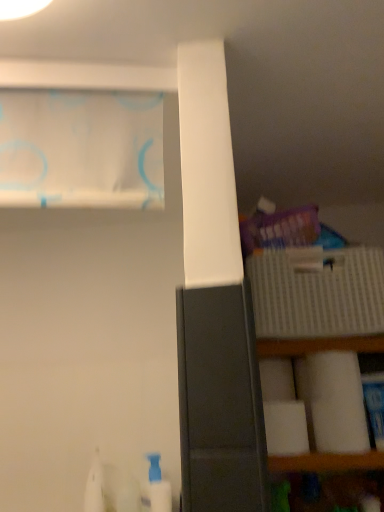
Question: Is white matte toilet paper at lower right, the first toilet paper from the back, surrounding white sheer curtain at upper left?

Choices:
 (A) no
 (B) yes

Answer: (A)

Question: Can you see white matte toilet paper at lower right, which ranks as the 2th toilet paper in front-to-back order, touching white sheer curtain at upper left?

Choices:
 (A) no
 (B) yes

Answer: (A)

Question: Is white matte toilet paper at lower right, the first toilet paper from the back, looking in the opposite direction of white sheer curtain at upper left?

Choices:
 (A) no
 (B) yes

Answer: (A)

Question: From the image's perspective, is white matte toilet paper at lower right, the first toilet paper from the back, located above white sheer curtain at upper left?

Choices:
 (A) yes
 (B) no

Answer: (B)

Question: Is the depth of white matte toilet paper at lower right, which ranks as the 2th toilet paper in front-to-back order, greater than that of white sheer curtain at upper left?

Choices:
 (A) no
 (B) yes

Answer: (B)

Question: From the image's perspective, does white matte toilet paper at lower right, which ranks as the 2th toilet paper in front-to-back order, appear lower than white sheer curtain at upper left?

Choices:
 (A) yes
 (B) no

Answer: (A)

Question: Is white sheer curtain at upper left at the back of white plastic bottle at lower left?

Choices:
 (A) no
 (B) yes

Answer: (A)

Question: Would you say white plastic bottle at lower left is a long distance from white sheer curtain at upper left?

Choices:
 (A) yes
 (B) no

Answer: (B)

Question: Does white plastic bottle at lower left appear on the left side of white sheer curtain at upper left?

Choices:
 (A) no
 (B) yes

Answer: (A)

Question: Is white plastic bottle at lower left wider than white sheer curtain at upper left?

Choices:
 (A) no
 (B) yes

Answer: (B)

Question: Is white plastic bottle at lower left next to white sheer curtain at upper left and touching it?

Choices:
 (A) yes
 (B) no

Answer: (B)

Question: Is white plastic bottle at lower left thinner than white sheer curtain at upper left?

Choices:
 (A) no
 (B) yes

Answer: (A)

Question: Is white matte toilet paper at right, which is the 1th toilet paper in front-to-back order, not inside white sheer curtain at upper left?

Choices:
 (A) no
 (B) yes

Answer: (B)